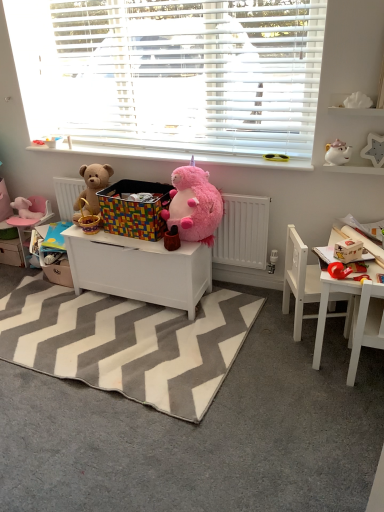
This screenshot has height=512, width=384. Find the location of `vacant space underneath white plastic blinds at upper center (from a real-world perspective)`. vacant space underneath white plastic blinds at upper center (from a real-world perspective) is located at coordinates (157, 151).